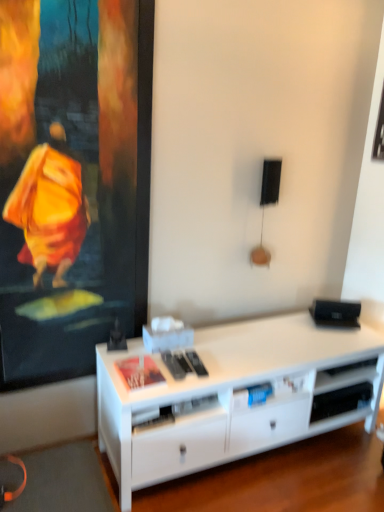
Question: Is white matte shelf at lower right positioned behind white matte desk at center?

Choices:
 (A) no
 (B) yes

Answer: (B)

Question: Is white matte shelf at lower right not close to white matte desk at center?

Choices:
 (A) no
 (B) yes

Answer: (A)

Question: From the image's perspective, is white matte shelf at lower right under white matte desk at center?

Choices:
 (A) no
 (B) yes

Answer: (B)

Question: Can you confirm if white matte shelf at lower right is taller than white matte desk at center?

Choices:
 (A) no
 (B) yes

Answer: (A)

Question: Is white matte shelf at lower right facing away from white matte desk at center?

Choices:
 (A) no
 (B) yes

Answer: (B)

Question: Does white matte shelf at lower right have a greater width compared to white matte desk at center?

Choices:
 (A) yes
 (B) no

Answer: (B)

Question: Is white matte shelf at lower right surrounded by white matte desk at center?

Choices:
 (A) yes
 (B) no

Answer: (A)

Question: From the image's perspective, is white matte desk at center located beneath white matte shelf at lower right?

Choices:
 (A) yes
 (B) no

Answer: (B)

Question: Is white matte desk at center oriented away from white matte shelf at lower right?

Choices:
 (A) yes
 (B) no

Answer: (A)

Question: Is white matte desk at center bigger than white matte shelf at lower right?

Choices:
 (A) no
 (B) yes

Answer: (B)

Question: Considering the relative sizes of white matte desk at center and white matte shelf at lower right in the image provided, is white matte desk at center smaller than white matte shelf at lower right?

Choices:
 (A) no
 (B) yes

Answer: (A)

Question: Is white matte desk at center at the left side of white matte shelf at lower right?

Choices:
 (A) yes
 (B) no

Answer: (A)

Question: From the image's perspective, relative to white matte shelf at lower right, is white matte desk at center above or below?

Choices:
 (A) above
 (B) below

Answer: (A)